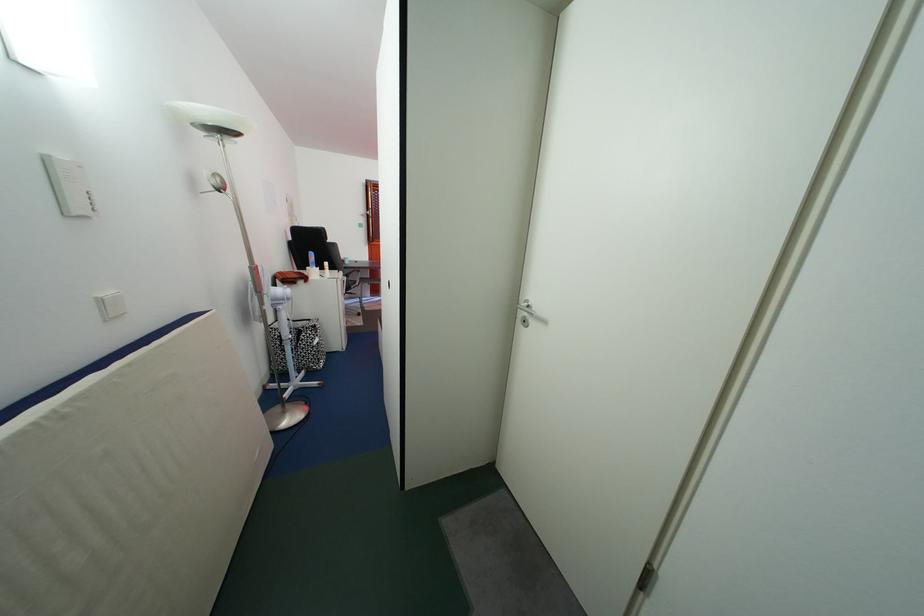
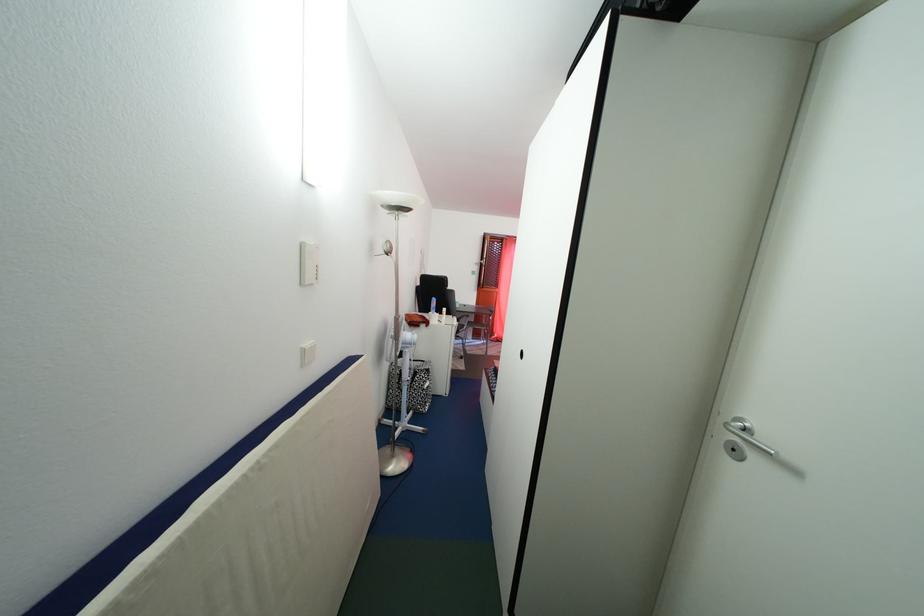
Question: How did the camera likely rotate?

Choices:
 (A) Left
 (B) Right
 (C) Up
 (D) Down

Answer: (A)